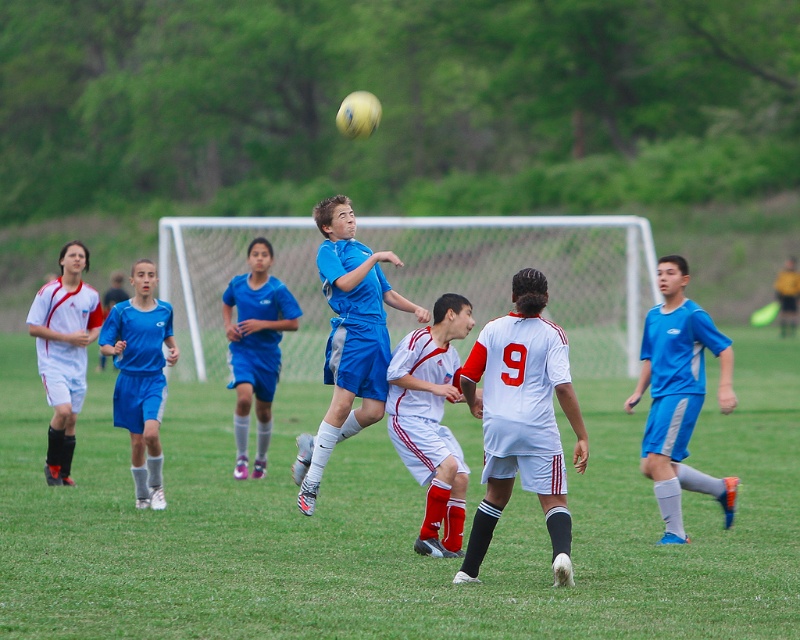
Which of these two, green grass football field at center or blue fabric soccer jersey at center, stands taller?

green grass football field at center is taller.

Measure the distance between point (412, 576) and camera.

Point (412, 576) is 10.51 meters from camera.

The width and height of the screenshot is (800, 640). Find the location of `green grass football field at center`. green grass football field at center is located at coordinates (392, 525).

Does matte blue shorts at right appear on the left side of white matte soccer player at center?

In fact, matte blue shorts at right is to the right of white matte soccer player at center.

Which of these two, matte blue shorts at right or white matte soccer player at center, stands taller?

With more height is matte blue shorts at right.

Locate an element on the screen. matte blue shorts at right is located at coordinates [678, 396].

Is green grass football field at center to the left of white matte soccer player at center from the viewer's perspective?

Yes, green grass football field at center is to the left of white matte soccer player at center.

Can you confirm if green grass football field at center is positioned below white matte soccer player at center?

Incorrect, green grass football field at center is not positioned below white matte soccer player at center.

What do you see at coordinates (392, 525) in the screenshot? I see `green grass football field at center` at bounding box center [392, 525].

Find the location of `green grass football field at center`. green grass football field at center is located at coordinates (392, 525).